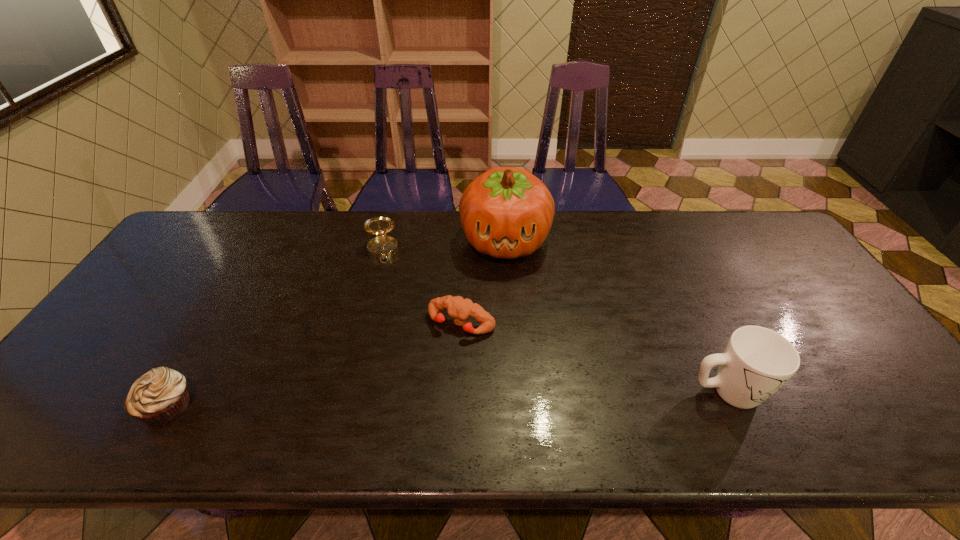
I want to click on free spot between the tallest object and the third tallest object, so click(x=444, y=246).

Find the location of a particular element. The image size is (960, 540). empty location between the mug and the third nearest object is located at coordinates (594, 357).

Identify the location of free space between the third shortest object and the tallest object. (444, 246).

The height and width of the screenshot is (540, 960). What are the coordinates of `vacant space that's between the pumpkin and the puncher` in the screenshot? It's located at (483, 282).

Identify the location of vacant space that's between the puncher and the second object from left to right. The height and width of the screenshot is (540, 960). (421, 287).

Identify the location of free space between the tallest object and the leftmost object. The height and width of the screenshot is (540, 960). (336, 323).

I want to click on vacant area between the third farthest object and the fourth shortest object, so click(x=594, y=357).

Where is `free space between the third tallest object and the second tallest object`? The width and height of the screenshot is (960, 540). free space between the third tallest object and the second tallest object is located at coordinates (554, 321).

The height and width of the screenshot is (540, 960). Identify the location of empty space between the tallest object and the muffin. (336, 323).

Identify the location of free space between the mug and the pumpkin. This screenshot has width=960, height=540. (616, 316).